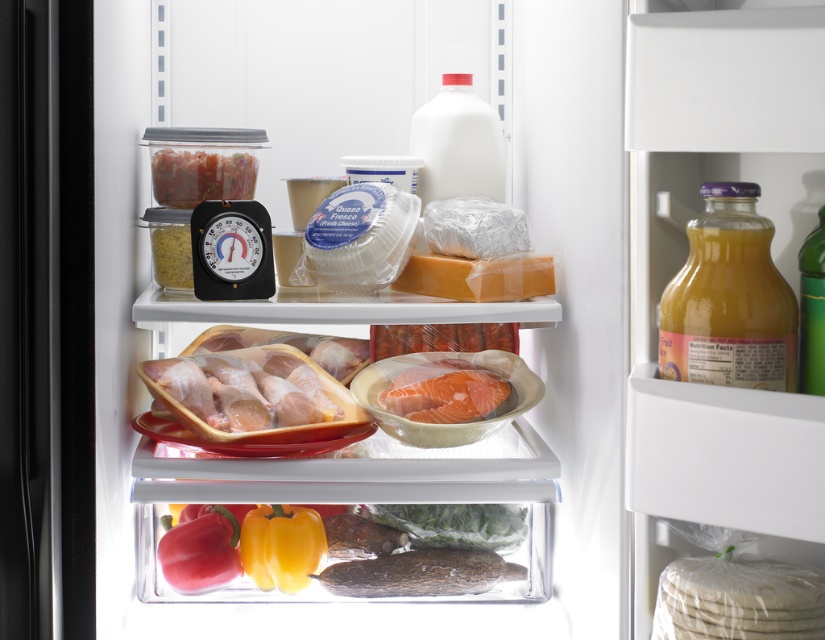
Question: Which of the following is the farthest from the observer?

Choices:
 (A) yellow matte pepper at lower center
 (B) pinkish translucent salmon at center
 (C) green leafy vegetables at bottom

Answer: (C)

Question: From the image, what is the correct spatial relationship of translucent plastic fish at lower center in relation to green glass bottle at right?

Choices:
 (A) right
 (B) left

Answer: (B)

Question: Which point is closer to the camera?

Choices:
 (A) (177, 538)
 (B) (243, 560)
 (C) (177, 195)

Answer: (A)

Question: Is translucent plastic fish at lower center positioned in front of translucent plastic container at upper left?

Choices:
 (A) yes
 (B) no

Answer: (A)

Question: Which point is closer to the camera taking this photo?

Choices:
 (A) (785, 577)
 (B) (753, 291)
 (C) (239, 534)
 (D) (456, 566)

Answer: (B)

Question: Is green leafy vegetables at bottom below translucent plastic container at upper left?

Choices:
 (A) no
 (B) yes

Answer: (B)